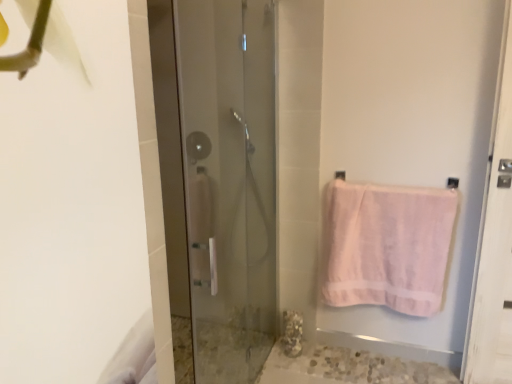
Question: Is clear glass shower at center positioned behind transparent glass shower door at center?

Choices:
 (A) no
 (B) yes

Answer: (B)

Question: Is clear glass shower at center wider than transparent glass shower door at center?

Choices:
 (A) yes
 (B) no

Answer: (B)

Question: Does clear glass shower at center turn towards transparent glass shower door at center?

Choices:
 (A) yes
 (B) no

Answer: (B)

Question: Is clear glass shower at center at the left side of transparent glass shower door at center?

Choices:
 (A) yes
 (B) no

Answer: (A)

Question: Is transparent glass shower door at center at the back of clear glass shower at center?

Choices:
 (A) yes
 (B) no

Answer: (B)

Question: Is pink cotton towel at right bigger or smaller than clear glass shower at center?

Choices:
 (A) small
 (B) big

Answer: (B)

Question: In the image, is pink cotton towel at right on the left side or the right side of clear glass shower at center?

Choices:
 (A) right
 (B) left

Answer: (A)

Question: Is point (342, 236) closer or farther from the camera than point (200, 135)?

Choices:
 (A) closer
 (B) farther

Answer: (A)

Question: From their relative heights in the image, would you say pink cotton towel at right is taller or shorter than clear glass shower at center?

Choices:
 (A) tall
 (B) short

Answer: (A)

Question: Does point (325, 296) appear closer or farther from the camera than point (222, 258)?

Choices:
 (A) farther
 (B) closer

Answer: (B)

Question: Looking at the image, does pink cotton towel at right seem bigger or smaller compared to transparent glass shower door at center?

Choices:
 (A) big
 (B) small

Answer: (B)

Question: From the image's perspective, is pink cotton towel at right positioned above or below transparent glass shower door at center?

Choices:
 (A) below
 (B) above

Answer: (A)

Question: In terms of height, does pink cotton towel at right look taller or shorter compared to transparent glass shower door at center?

Choices:
 (A) short
 (B) tall

Answer: (A)

Question: Is transparent glass shower door at center inside or outside of pink cotton towel at right?

Choices:
 (A) outside
 (B) inside

Answer: (A)

Question: Is transparent glass shower door at center bigger or smaller than pink cotton towel at right?

Choices:
 (A) small
 (B) big

Answer: (B)